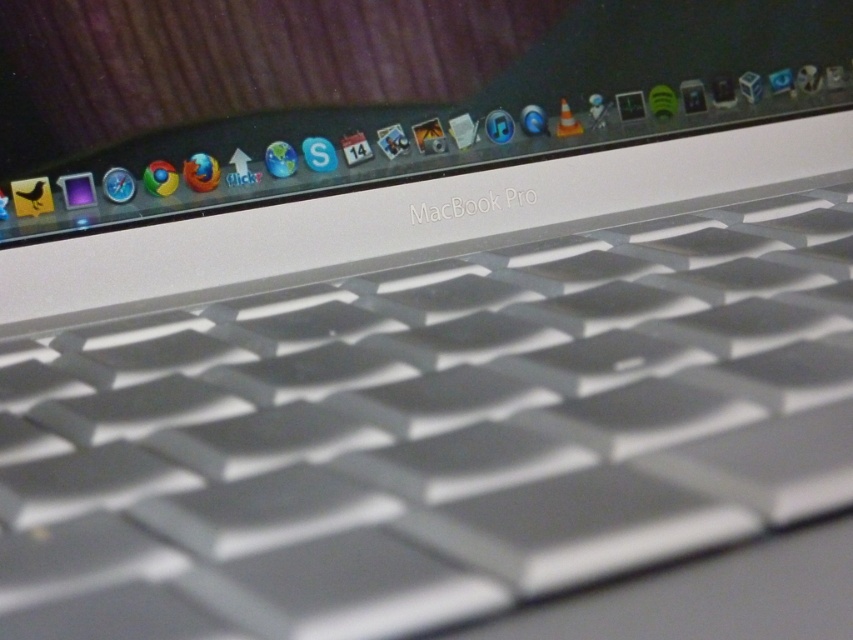
Between satin silver keyboard at center and satin silver macbook pro at upper center, which one has less height?

With less height is satin silver keyboard at center.

Between point (585, 410) and point (142, 38), which one is positioned in front?

Point (585, 410) is in front.

At what (x,y) coordinates should I click in order to perform the action: click on satin silver keyboard at center. Please return your answer as a coordinate pair (x, y). This screenshot has height=640, width=853. Looking at the image, I should click on (430, 432).